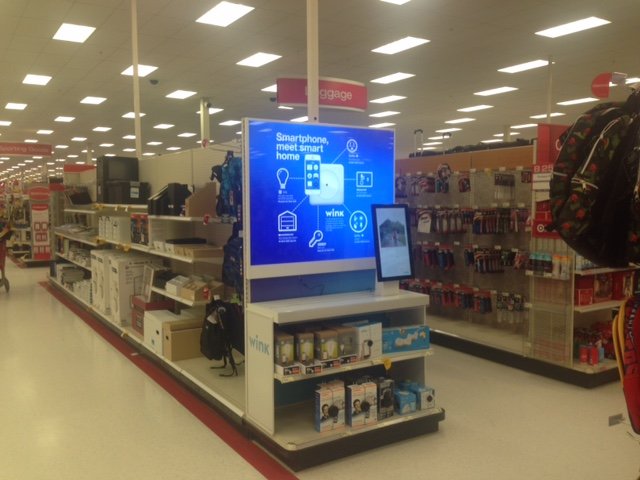
Find the location of a particular element. The image size is (640, 480). electronic display sign is located at coordinates point(323,193).